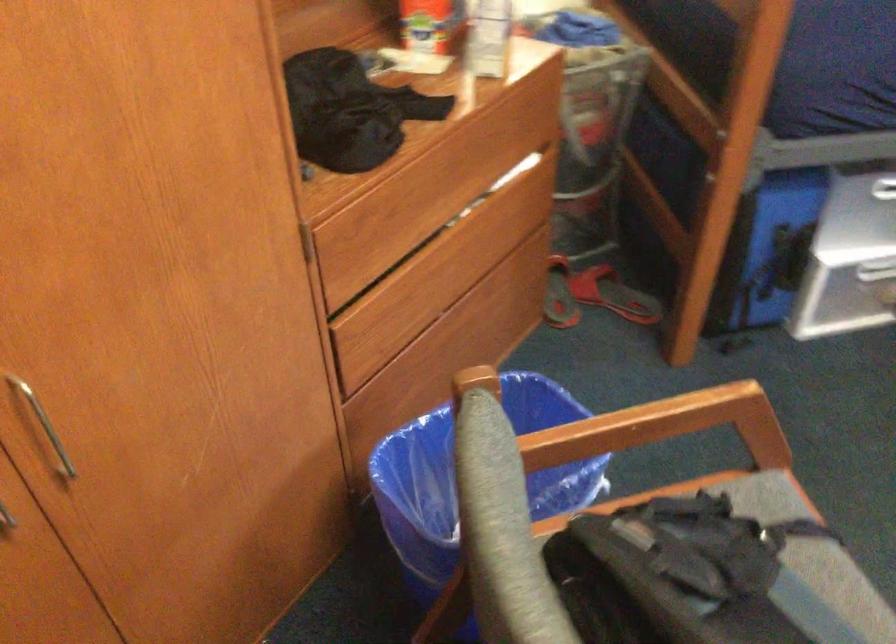
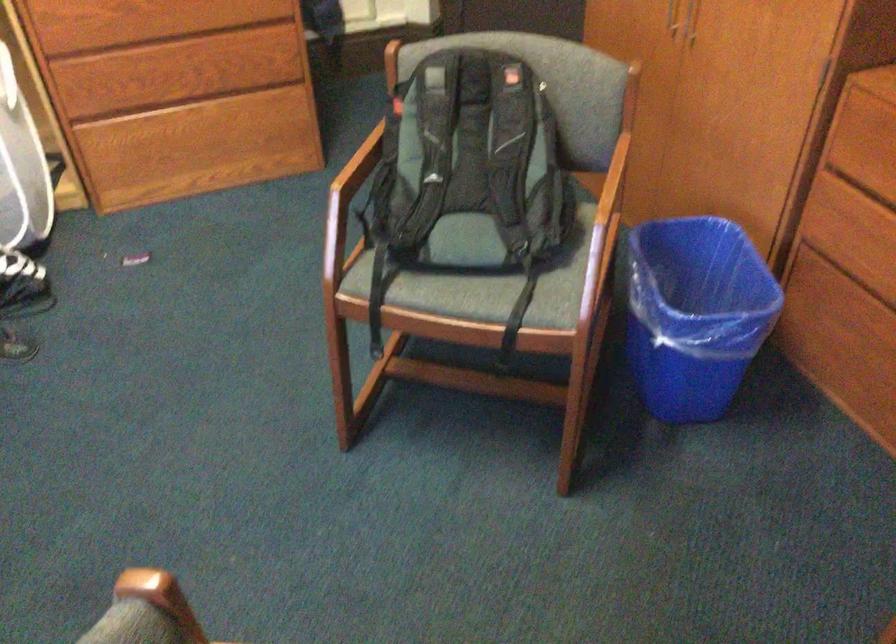
Find the pixel in the second image that matches point 359,259 in the first image.

(864, 161)